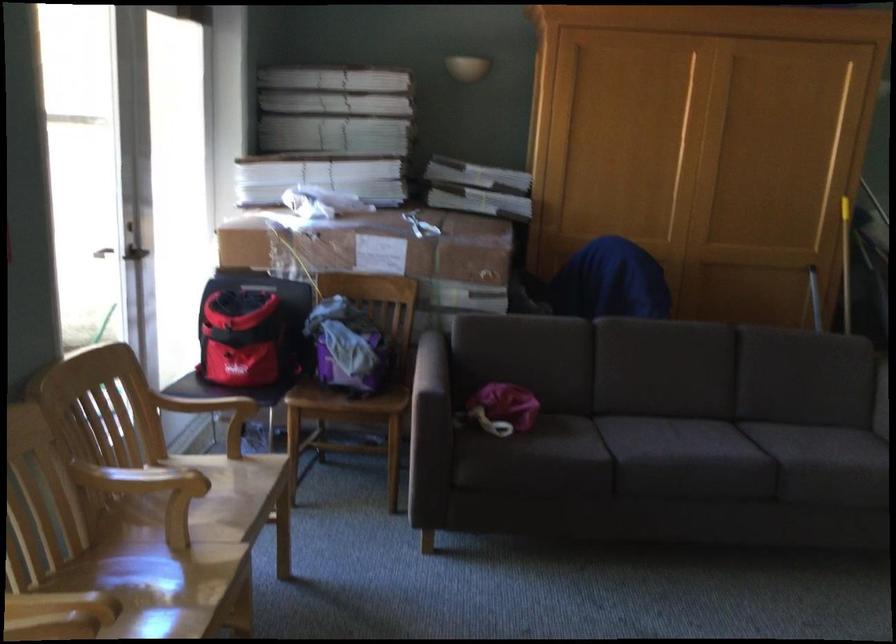
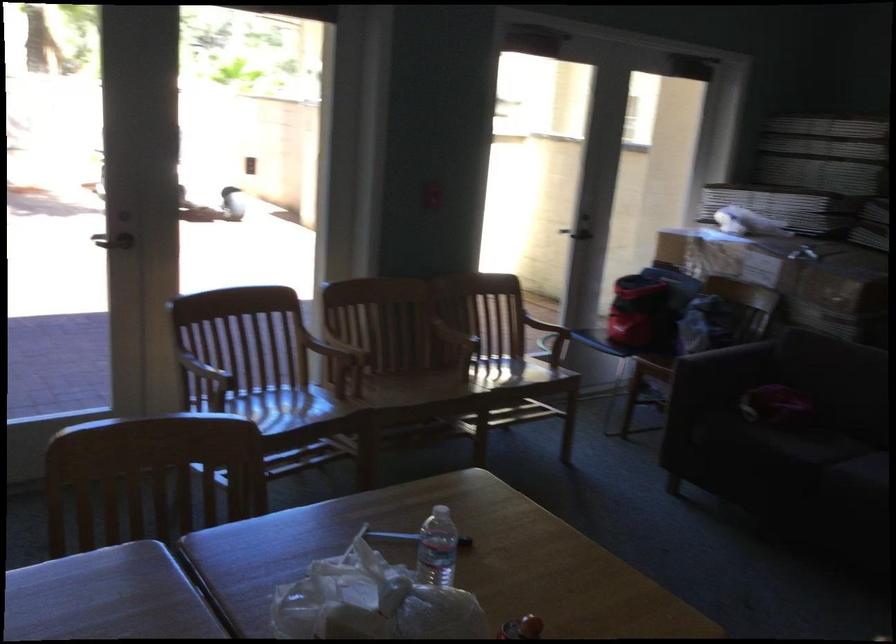
In the second image, find the point that corresponds to the point at 240,337 in the first image.

(645, 299)